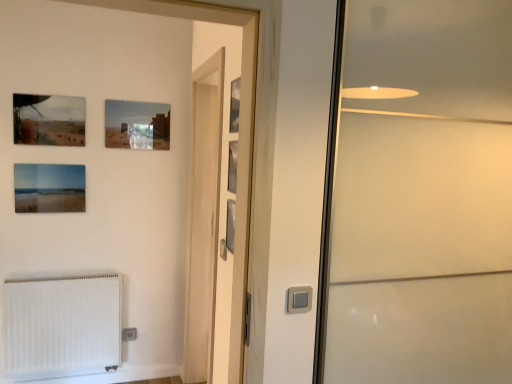
Question: Is matte glass picture frame at upper center, which is the 4th picture frame in right-to-left order, at the back of transparent glass screen door at right, the 2th screen door viewed from the left?

Choices:
 (A) yes
 (B) no

Answer: (B)

Question: From a real-world perspective, is transparent glass screen door at right, which appears as the first screen door when viewed from the right, over matte glass picture frame at upper center, which is the third picture frame in left-to-right order?

Choices:
 (A) no
 (B) yes

Answer: (A)

Question: From the image's perspective, is transparent glass screen door at right, which appears as the first screen door when viewed from the right, located beneath matte glass picture frame at upper center, the sixth picture frame from the front?

Choices:
 (A) no
 (B) yes

Answer: (B)

Question: Can you confirm if transparent glass screen door at right, which appears as the first screen door when viewed from the right, is wider than matte glass picture frame at upper center, which is the third picture frame in left-to-right order?

Choices:
 (A) yes
 (B) no

Answer: (A)

Question: Is transparent glass screen door at right, the 2th screen door viewed from the left, to the left of matte glass picture frame at upper center, which ranks as the first picture frame in back-to-front order, from the viewer's perspective?

Choices:
 (A) yes
 (B) no

Answer: (B)

Question: Does transparent glass screen door at right, the 2th screen door viewed from the left, appear on the right side of matte glass picture frame at upper center, which is the third picture frame in left-to-right order?

Choices:
 (A) no
 (B) yes

Answer: (B)

Question: Can you confirm if metallic silver picture frame at upper center, which is the 6th picture frame from back to front, is taller than metallic silver picture frame at center, which appears as the third picture frame when viewed from the front?

Choices:
 (A) yes
 (B) no

Answer: (A)

Question: Is metallic silver picture frame at center, which appears as the third picture frame when viewed from the right, surrounded by metallic silver picture frame at upper center, the 6th picture frame when ordered from left to right?

Choices:
 (A) no
 (B) yes

Answer: (A)

Question: From a real-world perspective, is metallic silver picture frame at upper center, the 6th picture frame when ordered from left to right, below metallic silver picture frame at center, which appears as the third picture frame when viewed from the front?

Choices:
 (A) yes
 (B) no

Answer: (B)

Question: Is metallic silver picture frame at upper center, which is the 1th picture frame from right to left, completely or partially outside of metallic silver picture frame at center, acting as the 4th picture frame starting from the back?

Choices:
 (A) yes
 (B) no

Answer: (A)

Question: Are metallic silver picture frame at upper center, the 6th picture frame when ordered from left to right, and metallic silver picture frame at center, which appears as the third picture frame when viewed from the front, located far from each other?

Choices:
 (A) no
 (B) yes

Answer: (A)

Question: Can you confirm if metallic silver picture frame at upper center, which is the 1th picture frame from right to left, is bigger than metallic silver picture frame at center, acting as the fourth picture frame starting from the left?

Choices:
 (A) yes
 (B) no

Answer: (B)

Question: Considering the relative sizes of transparent glass screen door at right, which appears as the first screen door when viewed from the right, and metallic silver picture frame at upper center, acting as the first picture frame starting from the front, in the image provided, is transparent glass screen door at right, which appears as the first screen door when viewed from the right, smaller than metallic silver picture frame at upper center, acting as the first picture frame starting from the front,?

Choices:
 (A) no
 (B) yes

Answer: (A)